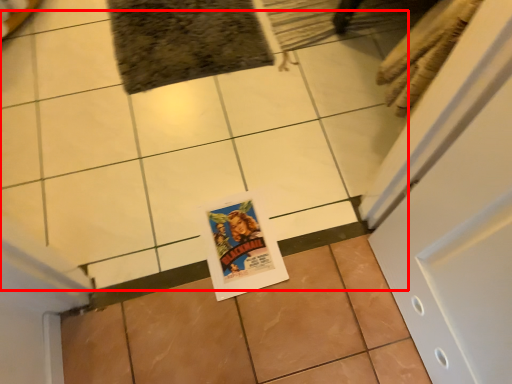
Question: Considering the relative positions of ceramic tile (annotated by the red box) and ceramic tile in the image provided, where is ceramic tile (annotated by the red box) located with respect to the staircase?

Choices:
 (A) right
 (B) left

Answer: (B)